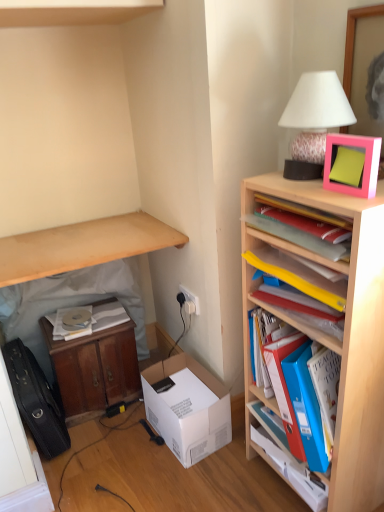
Identify the location of blank space situated above light wood shelf at upper left (from a real-world perspective). (88, 236).